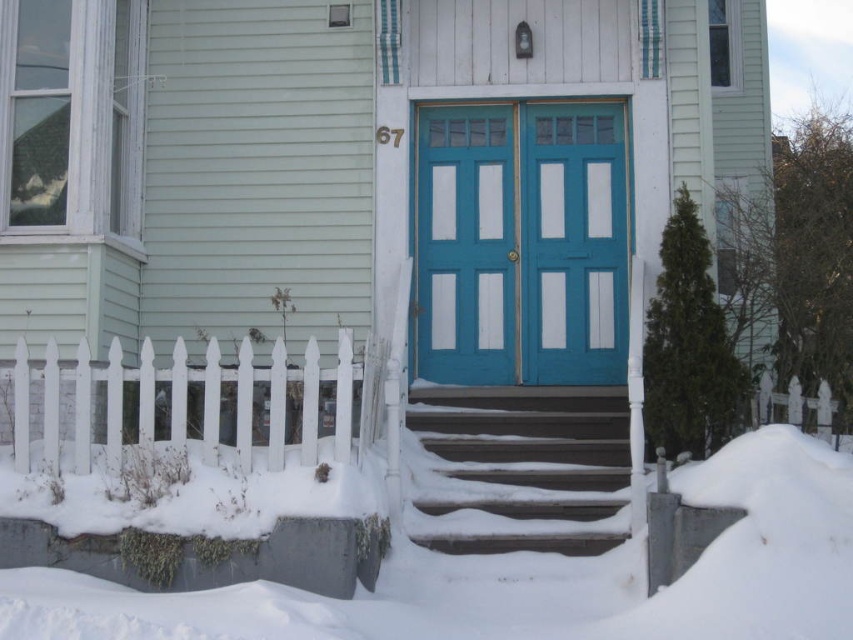
Is point (395, 637) positioned after point (608, 330)?

That is False.

Does white fluffy snow at lower center have a lesser height compared to teal painted wood door at center?

Correct, white fluffy snow at lower center is not as tall as teal painted wood door at center.

Does point (810, 493) come closer to viewer compared to point (431, 260)?

Yes, point (810, 493) is in front of point (431, 260).

The height and width of the screenshot is (640, 853). In order to click on white fluffy snow at lower center in this screenshot , I will do `click(531, 577)`.

Does white fluffy snow at lower center have a lesser width compared to smooth gray stairs at center?

No, white fluffy snow at lower center is not thinner than smooth gray stairs at center.

Which is below, white fluffy snow at lower center or smooth gray stairs at center?

white fluffy snow at lower center

Does point (141, 628) come closer to viewer compared to point (509, 461)?

Yes, point (141, 628) is closer to viewer.

Find the location of a particular element. The height and width of the screenshot is (640, 853). white fluffy snow at lower center is located at coordinates (531, 577).

Can you confirm if teal painted wood door at center is positioned below smooth gray stairs at center?

Actually, teal painted wood door at center is above smooth gray stairs at center.

Between teal painted wood door at center and smooth gray stairs at center, which one appears on the right side from the viewer's perspective?

Positioned to the right is teal painted wood door at center.

The image size is (853, 640). In order to click on teal painted wood door at center in this screenshot , I will do `click(521, 243)`.